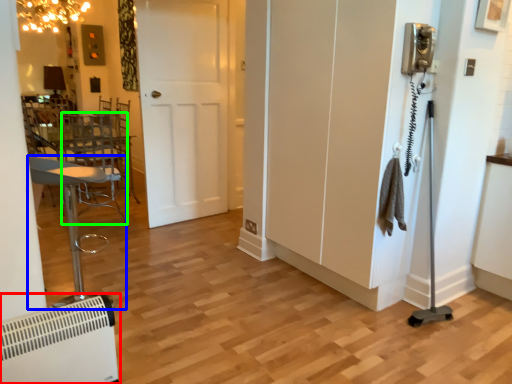
Question: Which object is the farthest from air conditioning (highlighted by a red box)? Choose among these: furniture (highlighted by a blue box) or swivel chair (highlighted by a green box).

Choices:
 (A) furniture
 (B) swivel chair

Answer: (B)